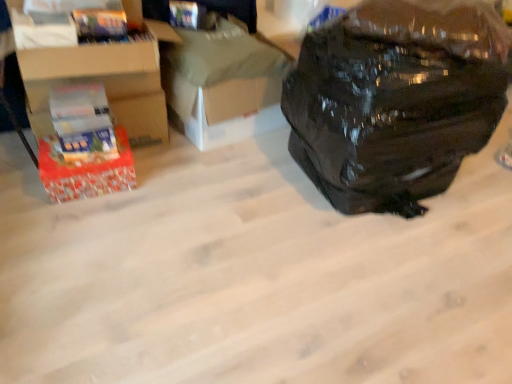
The image size is (512, 384). I want to click on vacant space that is to the left of red cardboard box at left, so click(x=19, y=185).